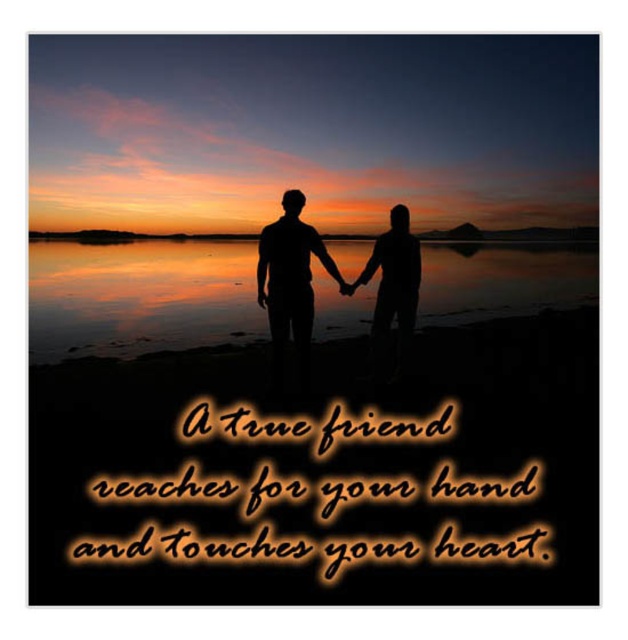
Who is taller, black matte silhouette at center or black matte silhouette of person at center?

With more height is black matte silhouette at center.

Can you confirm if black matte silhouette at center is thinner than black matte silhouette of person at center?

In fact, black matte silhouette at center might be wider than black matte silhouette of person at center.

You are a GUI agent. You are given a task and a screenshot of the screen. Output one action in this format:
    pyautogui.click(x=<x>, y=<y>)
    Task: Click on the black matte silhouette at center
    The height and width of the screenshot is (640, 628).
    Given the screenshot: What is the action you would take?
    pyautogui.click(x=290, y=273)